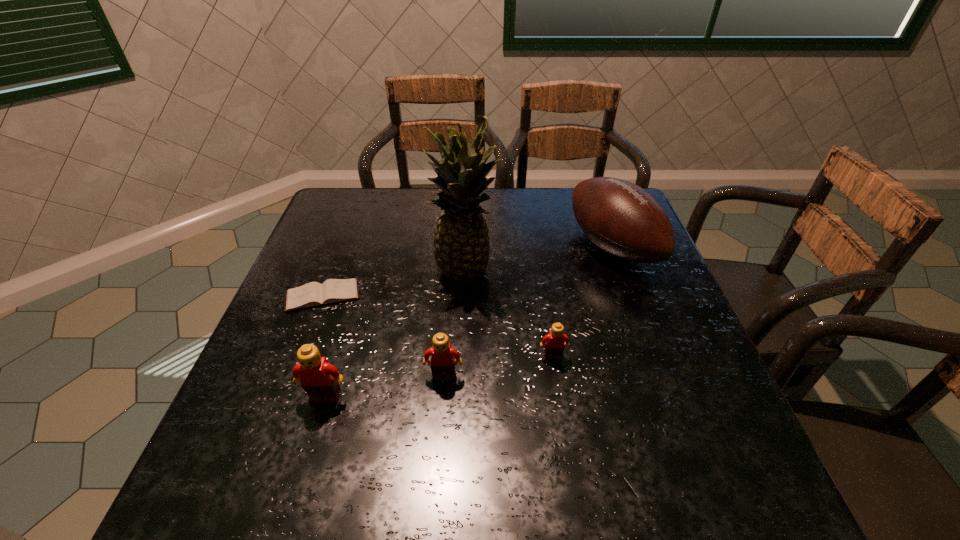
Considering the uniform spacing of Legos, where should an additional Lego be positioned on the right? Please locate a free spot. Please provide its 2D coordinates. Your answer should be formatted as a tuple, i.e. [(x, y)], where the tuple contains the x and y coordinates of a point satisfying the conditions above.

[(654, 339)]